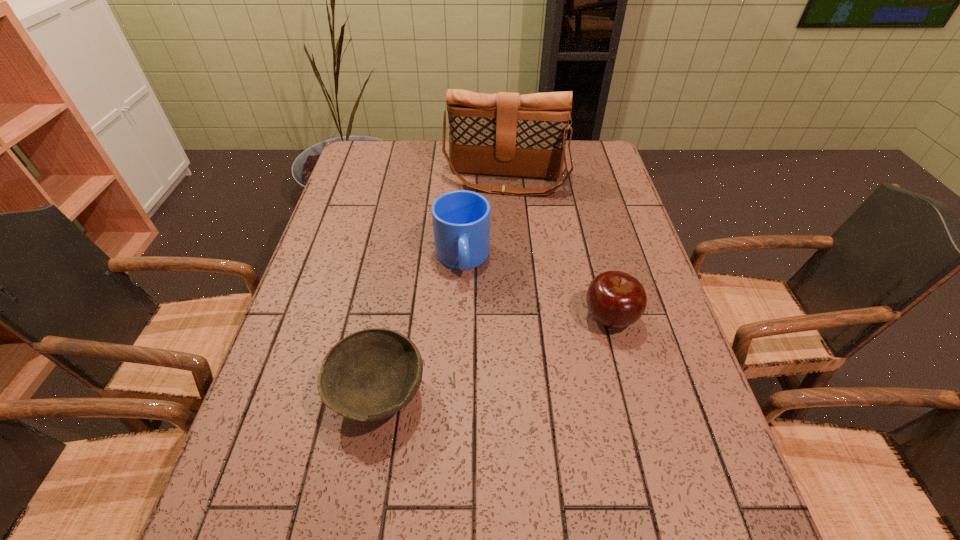
Locate an element on the screen. vacant spot on the desktop that is between the bowl and the apple and is positioned on the front-facing side of the farthest object is located at coordinates [481, 360].

Where is `vacant spot on the desktop that is between the nearest object and the second nearest object and is positioned on the side of the mug with the handle`? vacant spot on the desktop that is between the nearest object and the second nearest object and is positioned on the side of the mug with the handle is located at coordinates (474, 362).